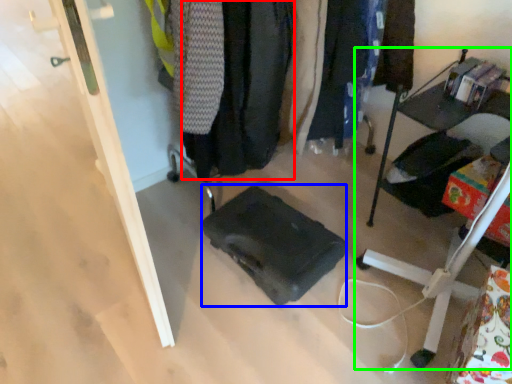
Question: Which object is positioned closest to clothing (highlighted by a red box)? Select from luggage (highlighted by a blue box) and furniture (highlighted by a green box).

Choices:
 (A) luggage
 (B) furniture

Answer: (A)